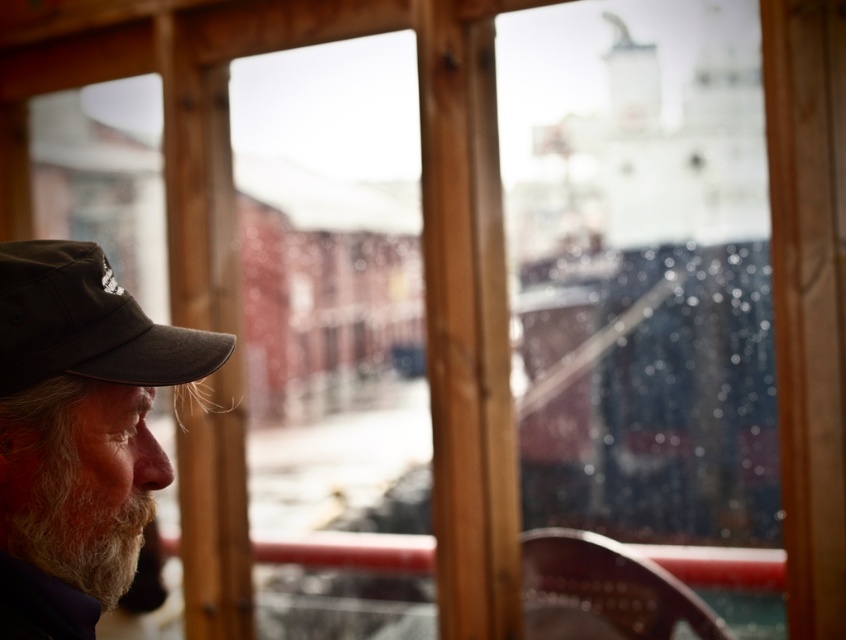
Which is behind, point (9, 436) or point (67, 452)?

Point (67, 452)

How distant is gray fabric cap at left from white fuzzy beard at lower left?

gray fabric cap at left and white fuzzy beard at lower left are 1.53 inches apart.

Which is in front, point (53, 632) or point (20, 435)?

Positioned in front is point (53, 632).

Find the location of `gray fabric cap at left`. gray fabric cap at left is located at coordinates (78, 429).

Does point (125, 307) come behind point (36, 440)?

Yes.

Find the location of a particular element. dark brown fabric baseball cap at lower left is located at coordinates (86, 323).

Is point (45, 413) closer to camera compared to point (89, 253)?

That is True.

Is the position of gray fabric cap at left less distant than that of dark brown fabric baseball cap at lower left?

Yes.

Between point (26, 384) and point (80, 312), which one is positioned behind?

Positioned behind is point (80, 312).

At what (x,y) coordinates should I click in order to perform the action: click on gray fabric cap at left. Please return your answer as a coordinate pair (x, y). Looking at the image, I should click on (78, 429).